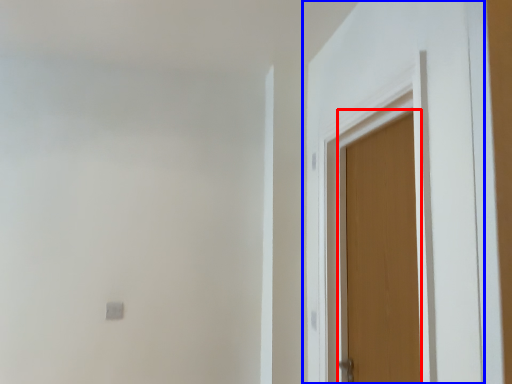
Question: Among these objects, which one is nearest to the camera, door (highlighted by a red box) or door (highlighted by a blue box)?

Choices:
 (A) door
 (B) door

Answer: (B)